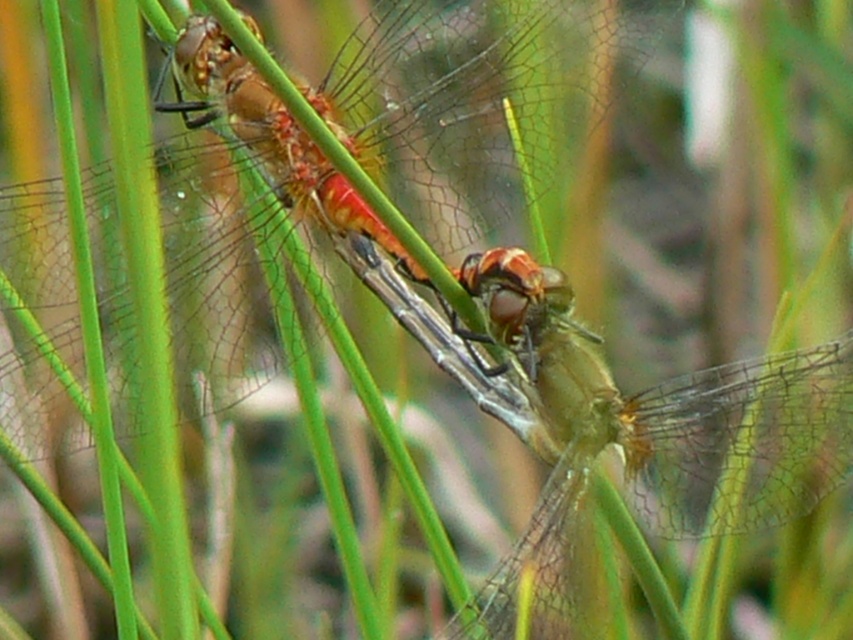
Question: Which point appears closest to the camera in this image?

Choices:
 (A) (543, 444)
 (B) (281, 147)

Answer: (A)

Question: Does translucent orange dragonfly at center have a greater width compared to translucent yellow-green dragonfly at center?

Choices:
 (A) yes
 (B) no

Answer: (A)

Question: Is translucent orange dragonfly at center bigger than translucent yellow-green dragonfly at center?

Choices:
 (A) no
 (B) yes

Answer: (B)

Question: From the image, what is the correct spatial relationship of translucent orange dragonfly at center in relation to translucent yellow-green dragonfly at center?

Choices:
 (A) right
 (B) left

Answer: (B)

Question: Which object is closer to the camera taking this photo?

Choices:
 (A) translucent yellow-green dragonfly at center
 (B) translucent orange dragonfly at center

Answer: (B)